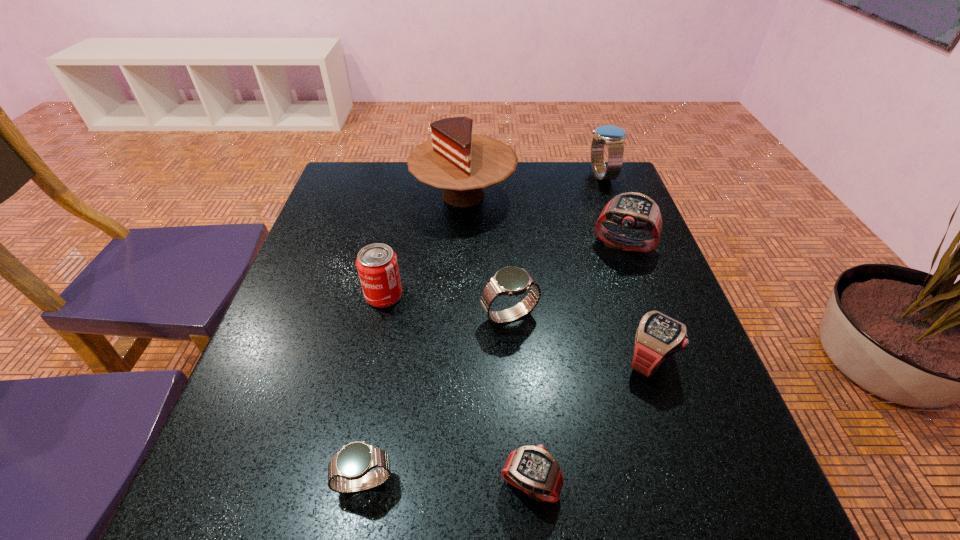
Locate an element on the screen. free point at the far left corner is located at coordinates (363, 188).

Find the location of a particular element. The height and width of the screenshot is (540, 960). vacant space at the near left corner of the desktop is located at coordinates (294, 504).

I want to click on vacant space at the far right corner of the desktop, so click(587, 171).

Image resolution: width=960 pixels, height=540 pixels. In the image, there is a desktop. In order to click on free space at the near right corner in this screenshot , I will do `click(749, 492)`.

The image size is (960, 540). Find the location of `empty space that is in between the third nearest watch and the smallest blue watch`. empty space that is in between the third nearest watch and the smallest blue watch is located at coordinates (507, 421).

Locate an element on the screen. vacant area between the second smallest red watch and the farthest red watch is located at coordinates (636, 302).

I want to click on vacant area that lies between the biggest red watch and the nearest red watch, so click(577, 365).

I want to click on vacant space that is in between the third nearest watch and the third farthest object, so click(x=636, y=302).

This screenshot has width=960, height=540. I want to click on free area in between the cake and the second blue watch from left to right, so click(x=487, y=255).

Where is `empty space between the red cake and the red can`? Image resolution: width=960 pixels, height=540 pixels. empty space between the red cake and the red can is located at coordinates (423, 245).